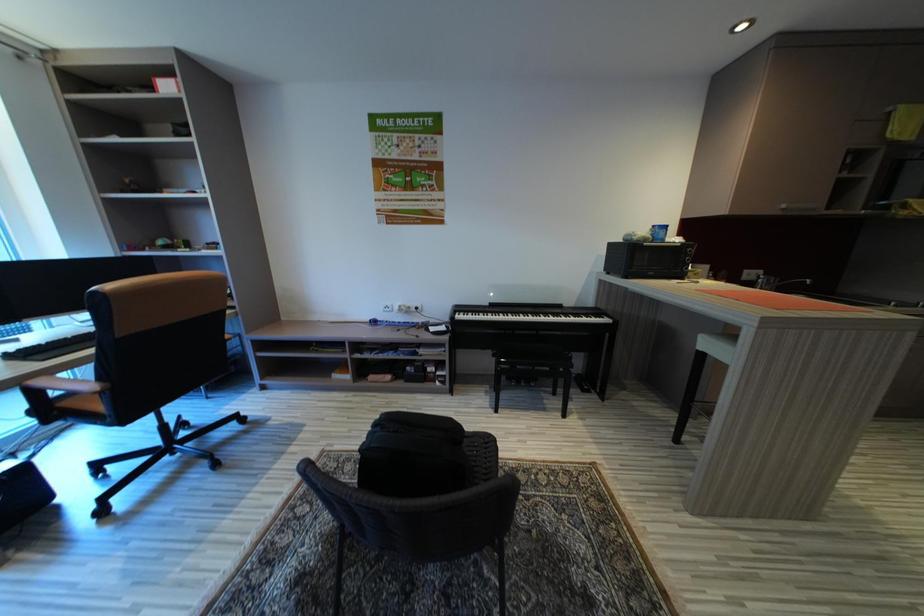
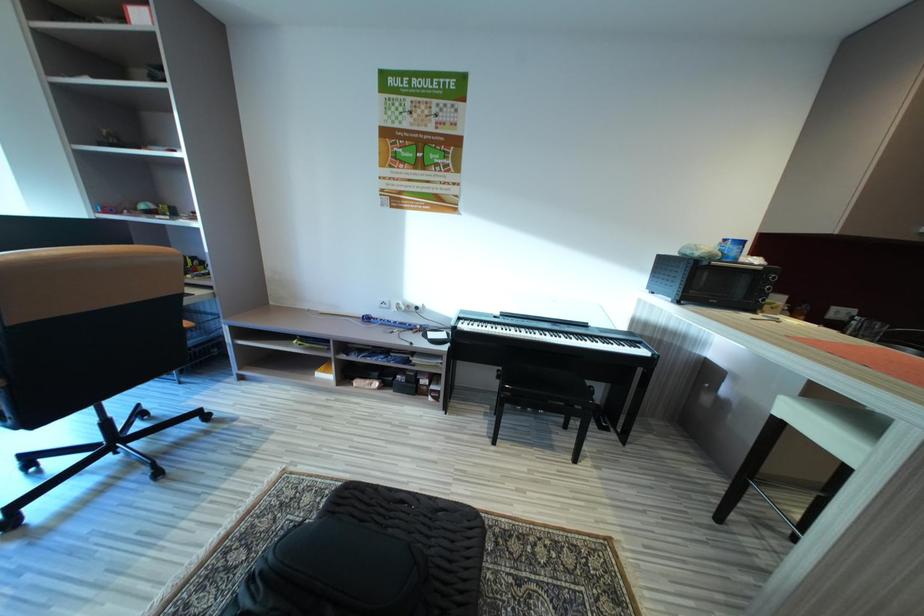
Question: How did the camera likely rotate?

Choices:
 (A) Left
 (B) Right
 (C) Up
 (D) Down

Answer: (A)